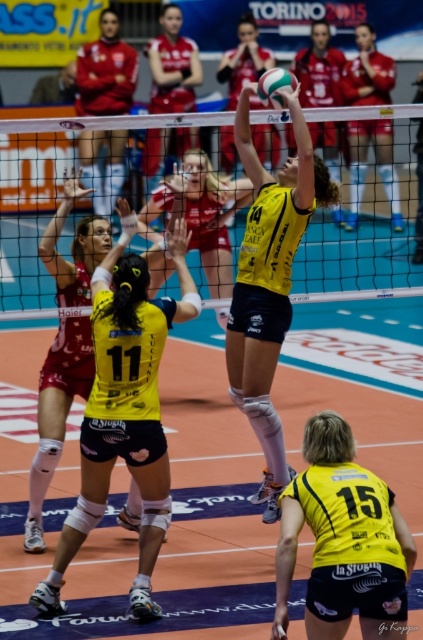
Question: Can you confirm if black mesh net at center is wider than yellow matte/vinyl volleyball player at center?

Choices:
 (A) yes
 (B) no

Answer: (A)

Question: Does yellow matte/vinyl volleyball at center have a smaller size compared to yellow matte volleyball at center?

Choices:
 (A) yes
 (B) no

Answer: (B)

Question: Among these objects, which one is farthest from the camera?

Choices:
 (A) black mesh net at center
 (B) white matte volleyball at center
 (C) yellow matte volleyball at center
 (D) matte red uniform at upper center

Answer: (C)

Question: Among these objects, which one is farthest from the camera?

Choices:
 (A) yellow matte volleyball at center
 (B) matte red jersey at upper right
 (C) yellow matte/vinyl volleyball at center

Answer: (A)

Question: Is black mesh net at center positioned behind yellow matte volleyball at center?

Choices:
 (A) yes
 (B) no

Answer: (B)

Question: Which point is farther from the camera taking this photo?

Choices:
 (A) (370, 56)
 (B) (271, 257)

Answer: (A)